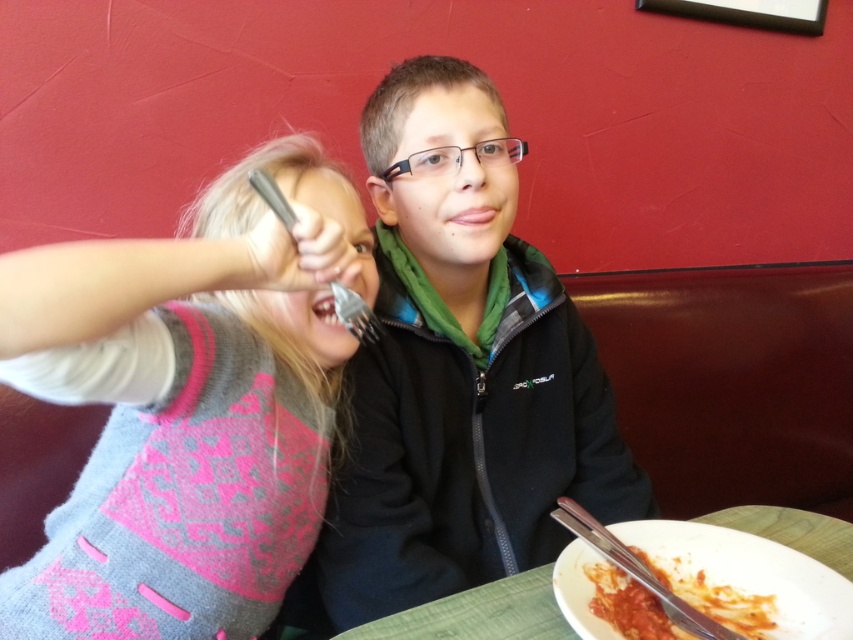
Question: Does knitted sweater at left have a lesser width compared to green wooden table at lower right?

Choices:
 (A) no
 (B) yes

Answer: (A)

Question: Which point is closer to the camera?

Choices:
 (A) knitted sweater at left
 (B) tomato sauce pasta at lower right

Answer: (A)

Question: Among these objects, which one is farthest from the camera?

Choices:
 (A) black matte jacket at center
 (B) tomato sauce pasta at lower right
 (C) knitted sweater at left

Answer: (A)

Question: Is black matte jacket at center smaller than green wooden table at lower right?

Choices:
 (A) yes
 (B) no

Answer: (B)

Question: Based on their relative distances, which object is farther from the knitted sweater at left?

Choices:
 (A) black matte jacket at center
 (B) tomato sauce pasta at lower right

Answer: (B)

Question: Can you confirm if black matte jacket at center is positioned to the right of tomato sauce pasta at lower right?

Choices:
 (A) yes
 (B) no

Answer: (B)